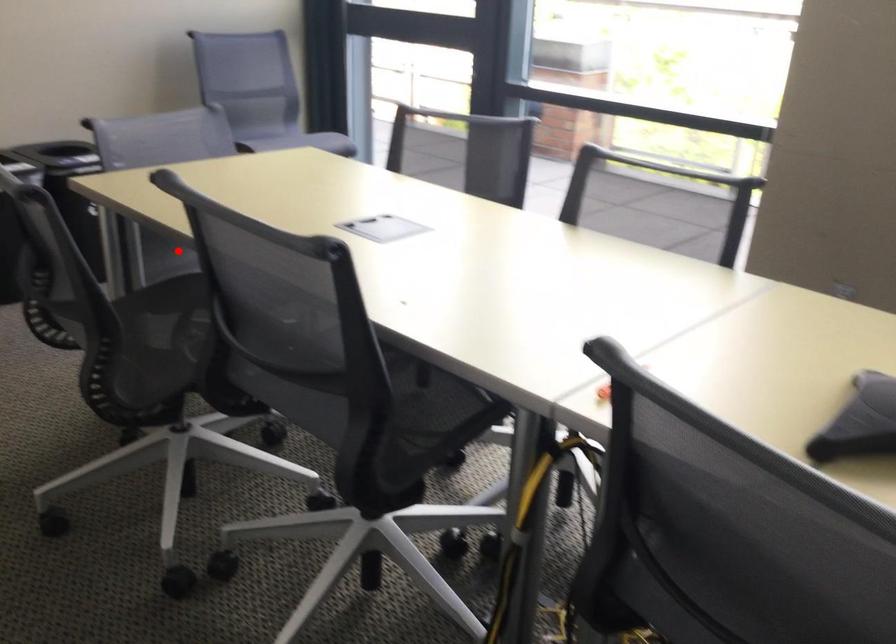
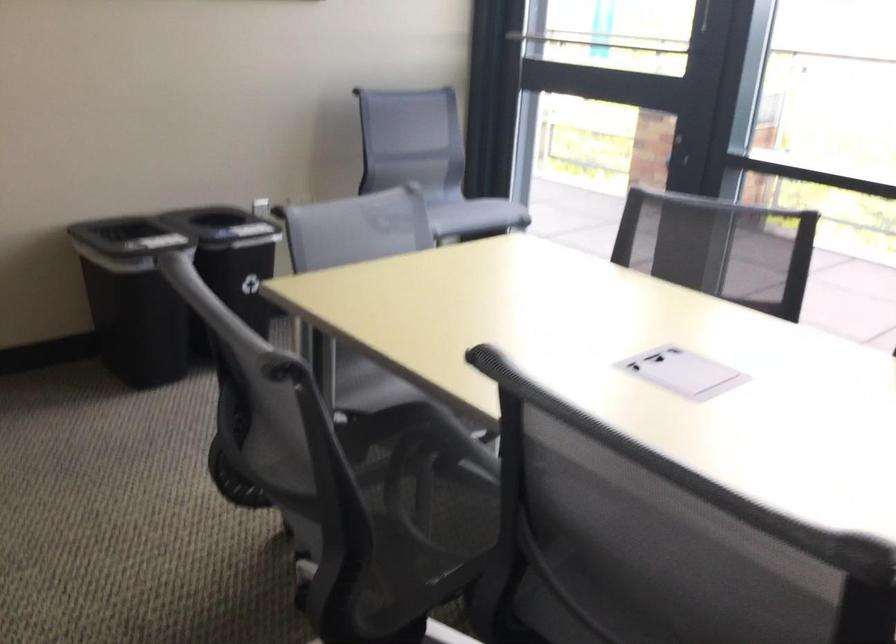
Question: I am providing you with two images of the same scene from different viewpoints. A red point is shown in image1. For the corresponding object point in image2, is it positioned nearer or farther from the camera?

Choices:
 (A) Nearer
 (B) Farther

Answer: (A)